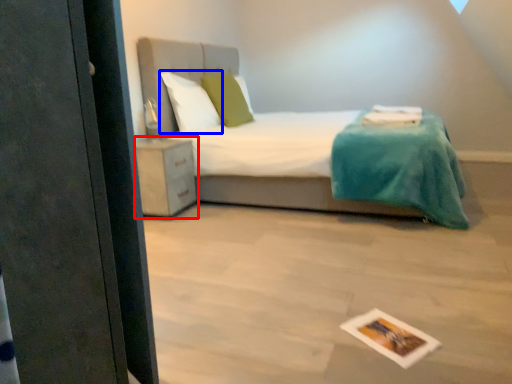
Question: Which object is closer to the camera taking this photo, nightstand (highlighted by a red box) or pillow (highlighted by a blue box)?

Choices:
 (A) nightstand
 (B) pillow

Answer: (A)